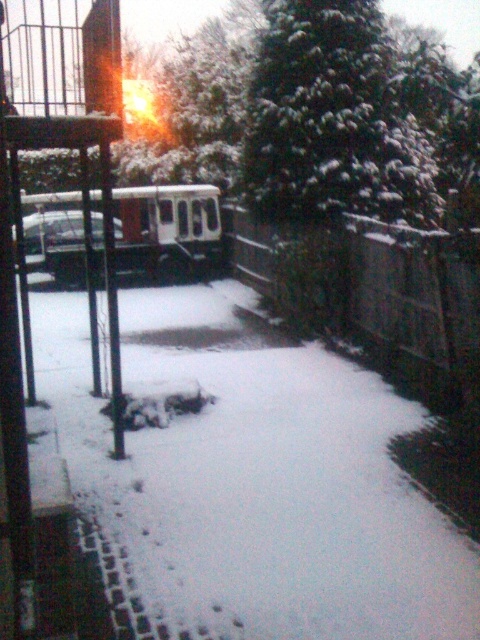
You are standing on the balcony and want to take a photo of the white matte train at center and the metallic silver car at left. Which object should you frame first in your camera viewfinder to ensure both are in the shot?

You should frame the metallic silver car at left first because the white matte train at center is positioned to the left of it, meaning the train is closer to the car and both can be captured by starting with the car as the reference point.